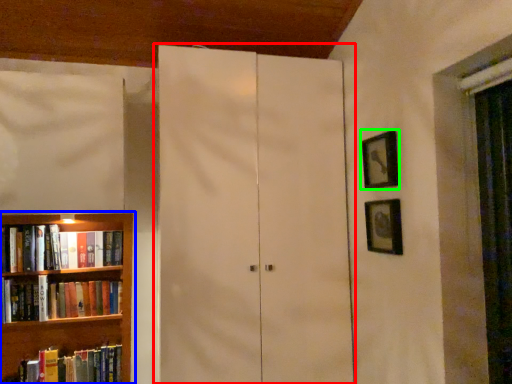
Question: Estimate the real-world distances between objects in this image. Which object is closer to cupboard (highlighted by a red box), bookcase (highlighted by a blue box) or picture frame (highlighted by a green box)?

Choices:
 (A) bookcase
 (B) picture frame

Answer: (B)